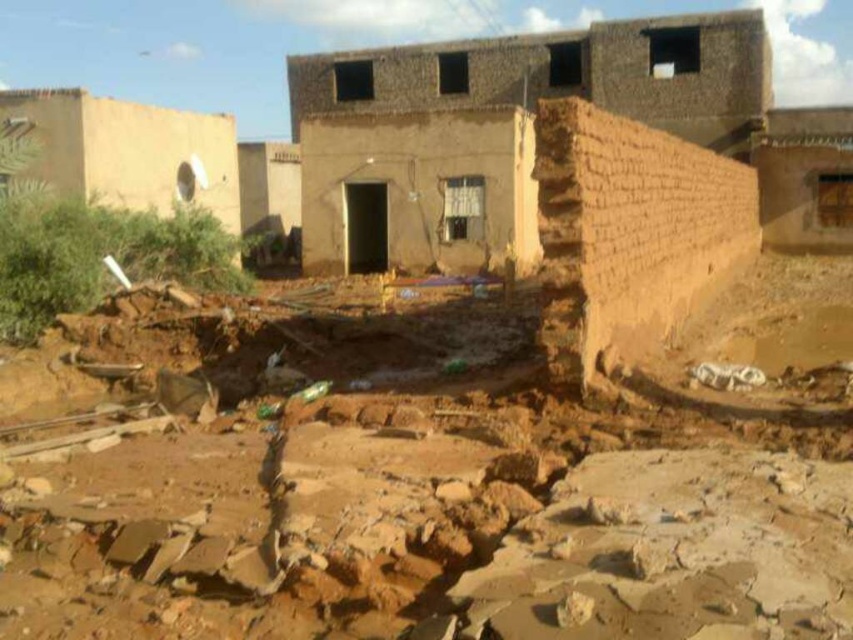
You are a geologist examining the scene of a natural disaster. You notice a point labeled as point (x=422, y=497) in the image. Based on the scene description, what material is present at this point?

The point (x=422, y=497) corresponds to the brown clay mud at center, so the material present there is brown clay mud.

You are a rescue worker trying to navigate through the disaster area. You see two points marked in the image. Which point is closer to you, point (335, 496) or point (711, 33)?

Point (335, 496) is closer to the viewer than point (711, 33).